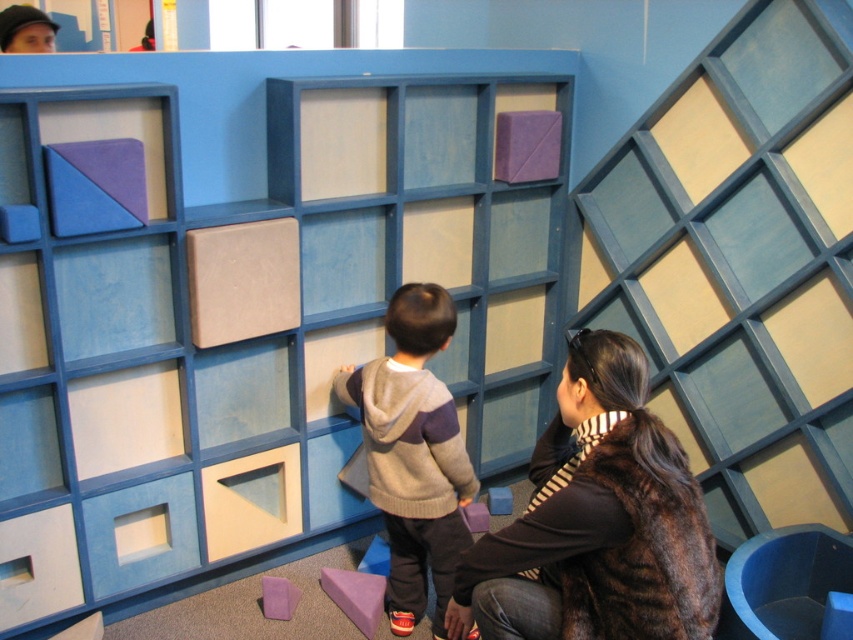
You are a parent trying to help your child play with the purple foam triangle at lower center and the purple matte cube at center. Which object should you hand to the child first if you want to give them the larger one first?

The purple foam triangle at lower center is larger than the purple matte cube at center, so you should hand the purple foam triangle at lower center first.

You are trying to decide which item is larger between the brown fur coat at center and the purple foam triangle at lower center. Which one is bigger?

The brown fur coat at center is bigger than the purple foam triangle at lower center.

You are a child trying to reach the purple matte cube at center. The purple foam triangle at lower center is in your way. Can you move around it to get to the cube?

The purple foam triangle at lower center is closer to the viewer than the purple matte cube at center, so you can move around it to reach the cube since it is not blocking the path directly.